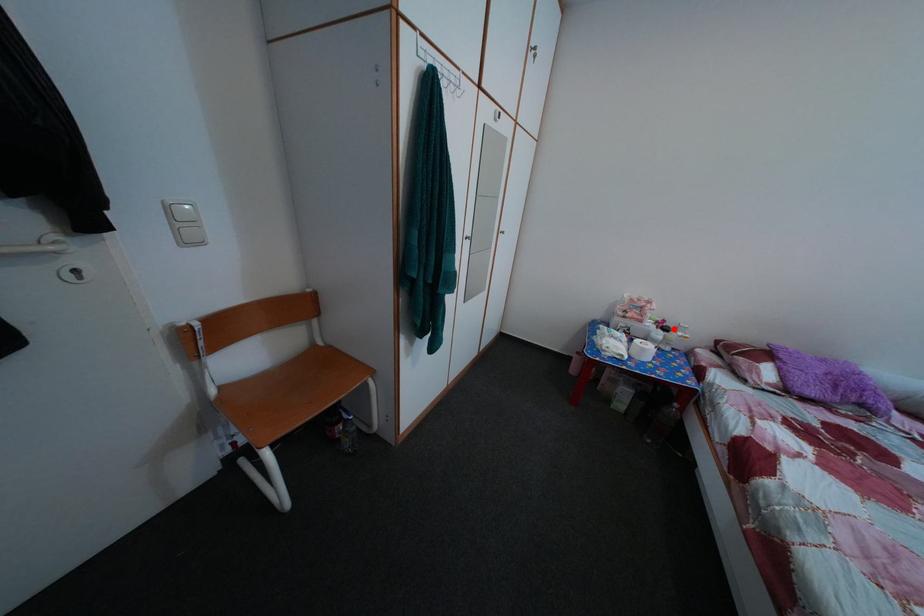
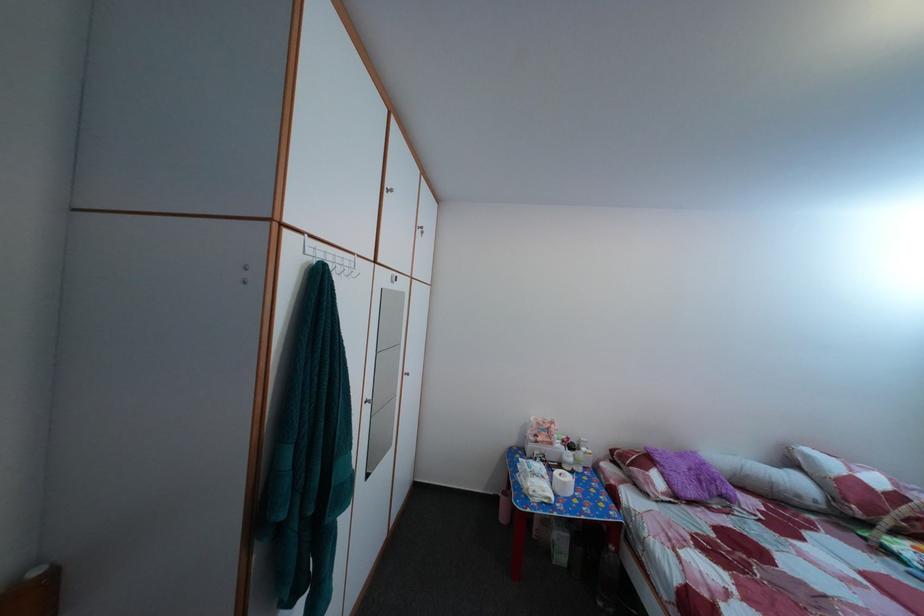
Question: I am providing you with two images of the same scene from different viewpoints. Image1 has a red point marked. In image2, the corresponding 3D location appears at what relative position? Reply with the corresponding letter.

Choices:
 (A) Closer
 (B) Farther

Answer: (B)